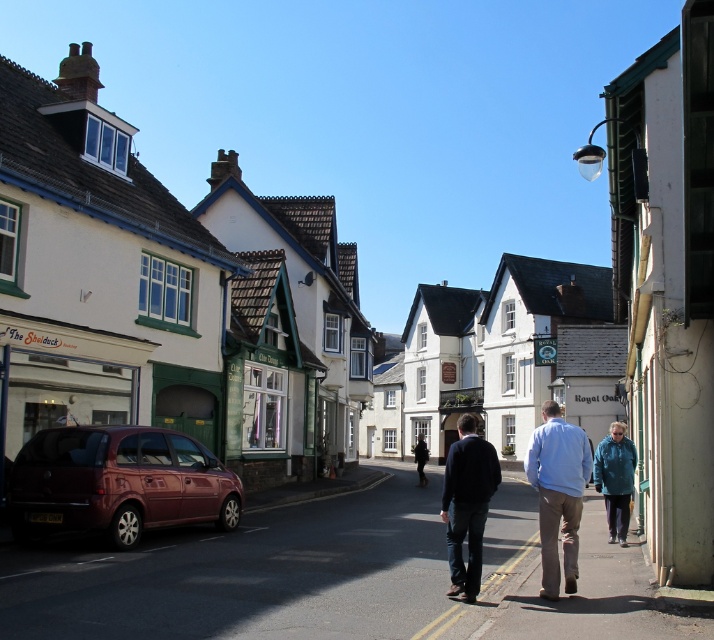
Question: Estimate the real-world distances between objects in this image. Which object is farther from the dark blue sweater at center?

Choices:
 (A) metallic car at lower left
 (B) light blue shirt at center
 (C) blue fabric jacket at center
 (D) shiny maroon hatchback at lower left

Answer: (D)

Question: Can you confirm if metallic car at lower left is positioned to the right of light blue shirt at center?

Choices:
 (A) yes
 (B) no

Answer: (B)

Question: Which of the following is the closest to the observer?

Choices:
 (A) light blue shirt at center
 (B) shiny maroon hatchback at lower left
 (C) dark blue sweater at center

Answer: (C)

Question: Is metallic car at lower left in front of shiny maroon hatchback at lower left?

Choices:
 (A) no
 (B) yes

Answer: (B)

Question: Does shiny maroon hatchback at lower left appear over dark blue sweater at center?

Choices:
 (A) yes
 (B) no

Answer: (A)

Question: Among these objects, which one is farthest from the camera?

Choices:
 (A) metallic car at lower left
 (B) shiny maroon hatchback at lower left
 (C) dark blue sweater at center
 (D) light blue shirt at center

Answer: (B)